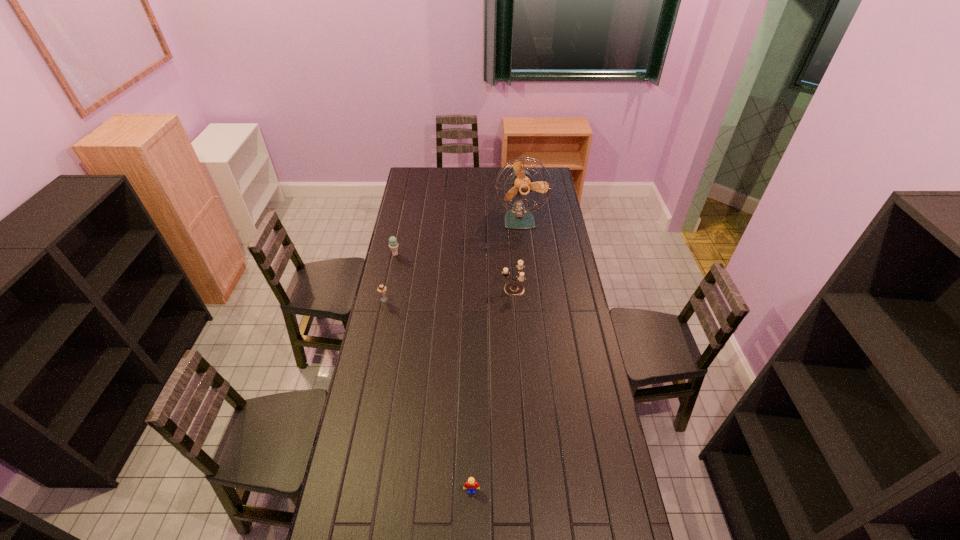
I want to click on vacant space located 0.140m on the right of the farther ice cream, so [x=427, y=254].

What are the coordinates of `free space located 0.080m on the front-facing side of the third object from left to right` in the screenshot? It's located at (471, 521).

This screenshot has width=960, height=540. Identify the location of object positioned at the right edge. (518, 217).

Image resolution: width=960 pixels, height=540 pixels. I want to click on free space at the left edge of the desktop, so click(x=377, y=365).

Identify the location of vacant position at the right edge of the desktop. The width and height of the screenshot is (960, 540). (552, 272).

Locate an element on the screen. free space at the far left corner of the desktop is located at coordinates (418, 185).

Identify the location of free spot between the fourth nearest object and the second tallest object. (454, 272).

Find the location of `free spot between the nearer ice cream and the candle holder`. free spot between the nearer ice cream and the candle holder is located at coordinates (448, 294).

This screenshot has width=960, height=540. I want to click on vacant area that lies between the fourth shortest object and the farthest object, so tap(516, 254).

What are the coordinates of `vacant point located between the farther ice cream and the nearest object` in the screenshot? It's located at (434, 372).